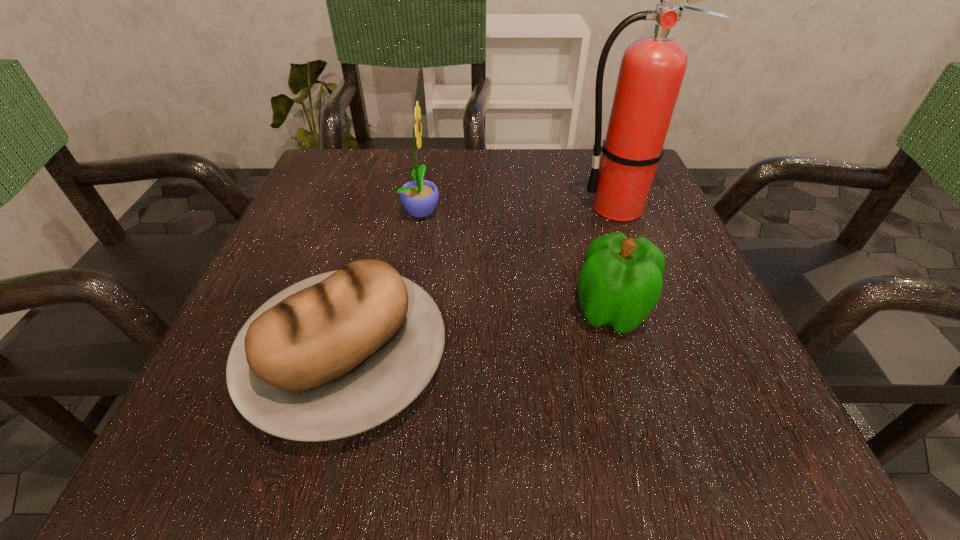
You are a GUI agent. You are given a task and a screenshot of the screen. Output one action in this format:
    pyautogui.click(x=<x>, y=<y>)
    Task: Click on the blank area in the image that satisfies the following two spatial constraints: 1. on the front-facing side of the sunflower; 2. on the front side of the bread
    This screenshot has width=960, height=540.
    Given the screenshot: What is the action you would take?
    pyautogui.click(x=398, y=356)

Where is `free space in the image that satisfies the following two spatial constraints: 1. on the hose direction of the tallest object; 2. on the front side of the bell pepper`? free space in the image that satisfies the following two spatial constraints: 1. on the hose direction of the tallest object; 2. on the front side of the bell pepper is located at coordinates (660, 311).